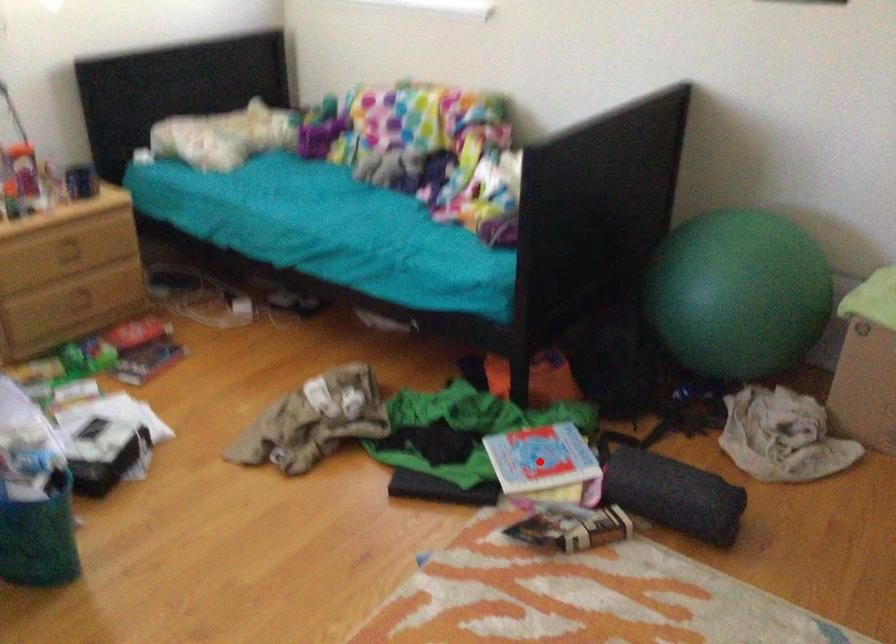
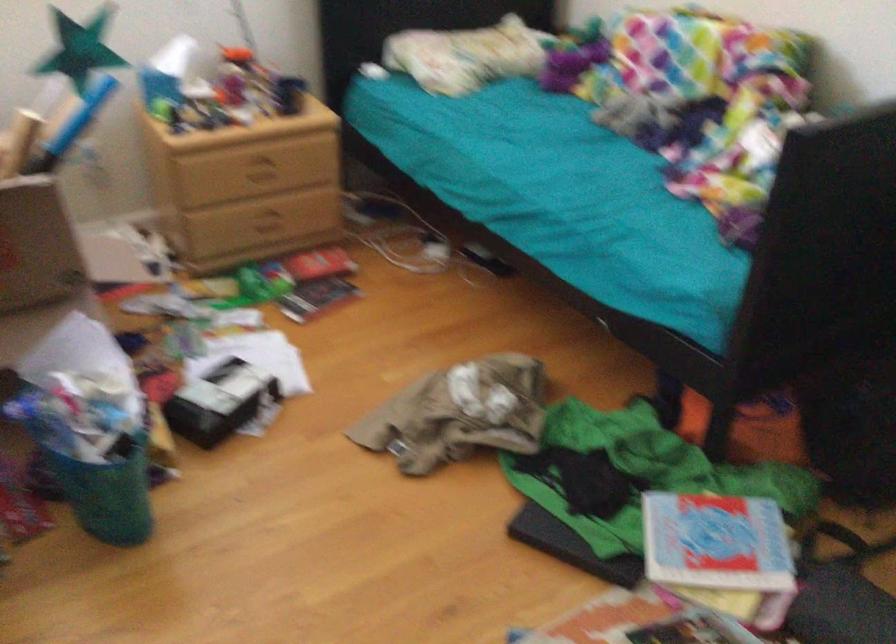
Question: I am providing you with two images of the same scene from different viewpoints. Given a red point in image1, look at the same physical point in image2. Is it:

Choices:
 (A) Closer to the viewpoint
 (B) Farther from the viewpoint

Answer: (A)